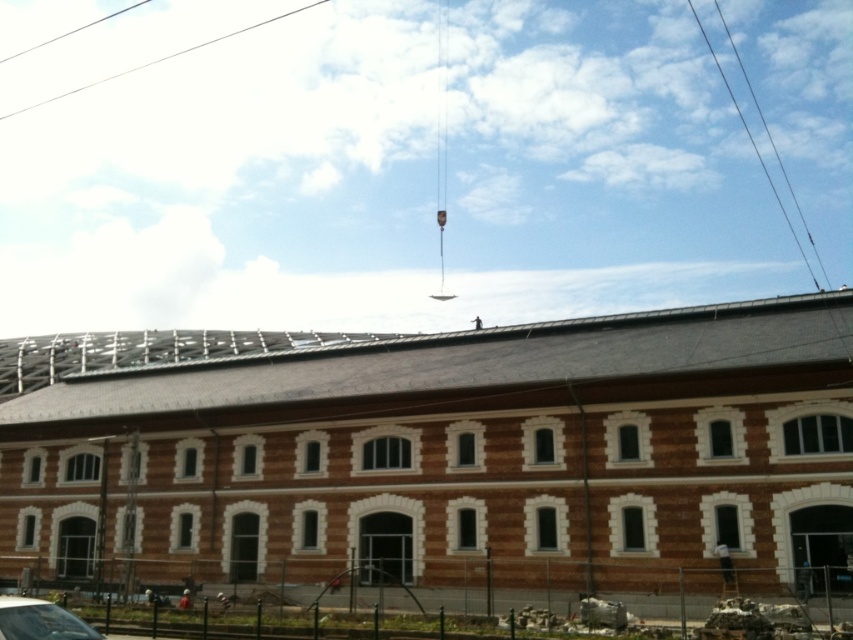
Which of these two, clear glass car at lower left or metallic wire at upper center, stands taller?

metallic wire at upper center

From the picture: Between clear glass car at lower left and metallic wire at upper center, which one appears on the right side from the viewer's perspective?

Positioned to the right is clear glass car at lower left.

The image size is (853, 640). Identify the location of clear glass car at lower left. (39, 620).

The image size is (853, 640). In order to click on clear glass car at lower left in this screenshot , I will do `click(39, 620)`.